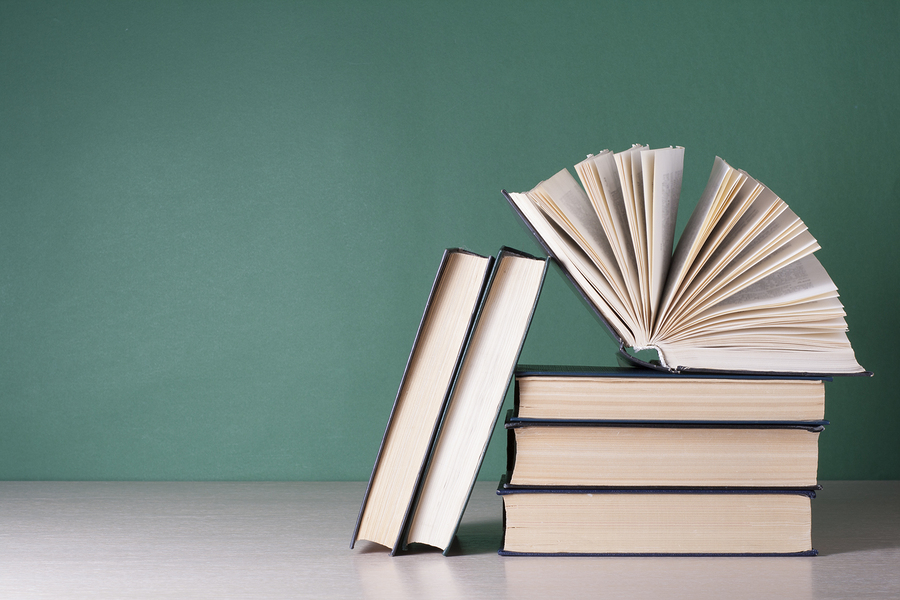
You are a GUI agent. You are given a task and a screenshot of the screen. Output one action in this format:
    pyautogui.click(x=<x>, y=<y>)
    Task: Click on the closed books
    
    Given the screenshot: What is the action you would take?
    pyautogui.click(x=400, y=454), pyautogui.click(x=443, y=471), pyautogui.click(x=583, y=523), pyautogui.click(x=622, y=462), pyautogui.click(x=608, y=397)